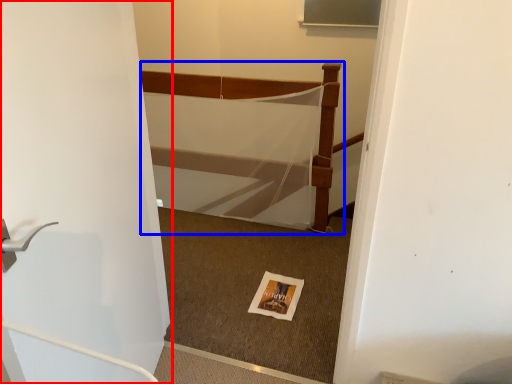
Question: Which object appears farthest to the camera in this image, door (highlighted by a red box) or bed (highlighted by a blue box)?

Choices:
 (A) door
 (B) bed

Answer: (B)